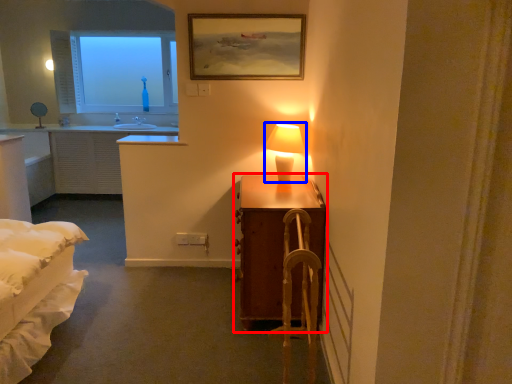
Question: Which object appears farthest to the camera in this image, table (highlighted by a red box) or table lamp (highlighted by a blue box)?

Choices:
 (A) table
 (B) table lamp

Answer: (B)